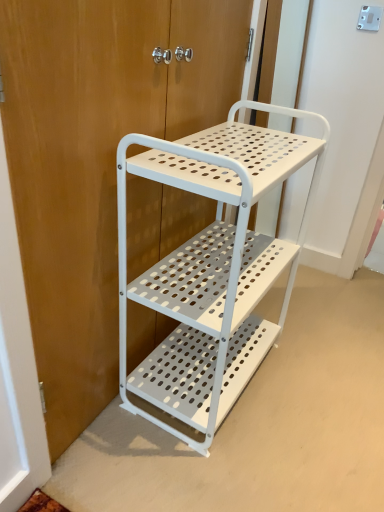
You are a GUI agent. You are given a task and a screenshot of the screen. Output one action in this format:
    pyautogui.click(x=<x>, y=<y>)
    Task: Click on the empty space that is to the right of white metal door at center
    
    Given the screenshot: What is the action you would take?
    pyautogui.click(x=319, y=373)